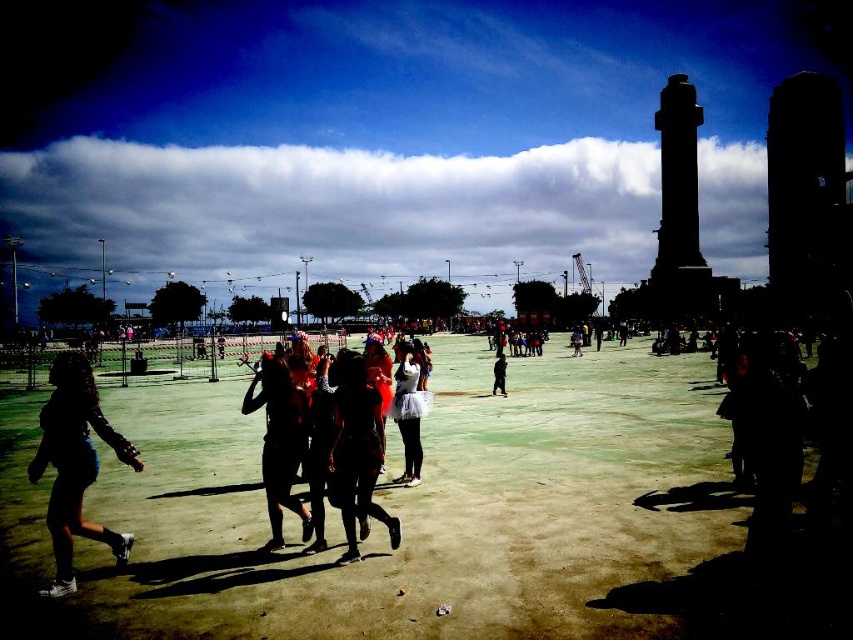
You are a photographer trying to capture the silhouette fabric at lower left and the white fluffy skirt at center in the same frame. Based on their positions, which object should you focus on first if you want to ensure both are in focus?

The silhouette fabric at lower left is below the white fluffy skirt at center, so you should focus on the white fluffy skirt at center first to ensure both are in focus since it is closer to the camera.

You are a photographer trying to capture a photo of the silhouette fabric at lower left and the black fabric dress at center. Which object should you focus on first if you want to include both in your frame without moving the camera?

The silhouette fabric at lower left should be focused on first because it is positioned on the left side of the black fabric dress at center, so adjusting focus to the left will ensure both are in the frame.

You are a photographer trying to capture the silhouette fabric at lower left and the black fabric dress at center in the same frame. Which object should you focus on first if you want to ensure both are in focus without adjusting your camera settings?

The silhouette fabric at lower left is bigger than the black fabric dress at center, so focusing on the silhouette fabric at lower left first would help ensure both are in focus since it is larger and likely closer to the camera.